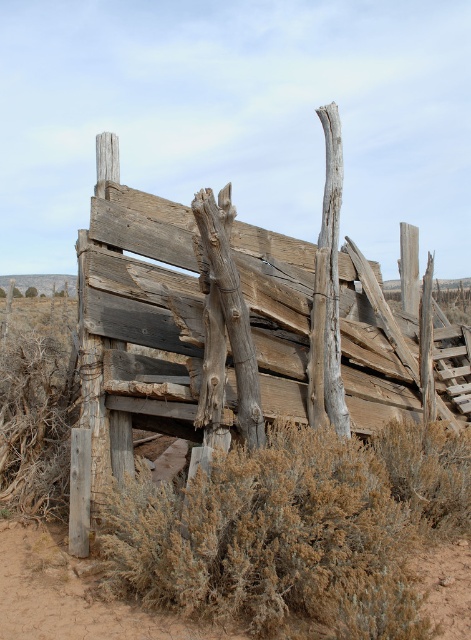
You are standing in front of the weathered wooden structure and want to walk from point A to point B. Point A is located at coordinates point (335, 204) and point B is at point (273, 564). Since the structure is leaning, which point is closer to you when you are facing the structure?

Point A at (335, 204) is closer to you because it is further to the viewer than point B at (273, 564), meaning it is physically nearer in the 3D space of the image.

You are a hiker trying to navigate through a desert. You see a weathered wood fence at center and a brown dry bush at lower center. Which object is positioned to the left when viewed from your perspective?

The weathered wood fence at center is to the left of the brown dry bush at lower center.

You are a hiker trying to navigate through the desert. You see the weathered wood fence at center and the brown dry bush at lower center. Which object is closer to you?

The brown dry bush at lower center is closer to you because the weathered wood fence at center is further away.